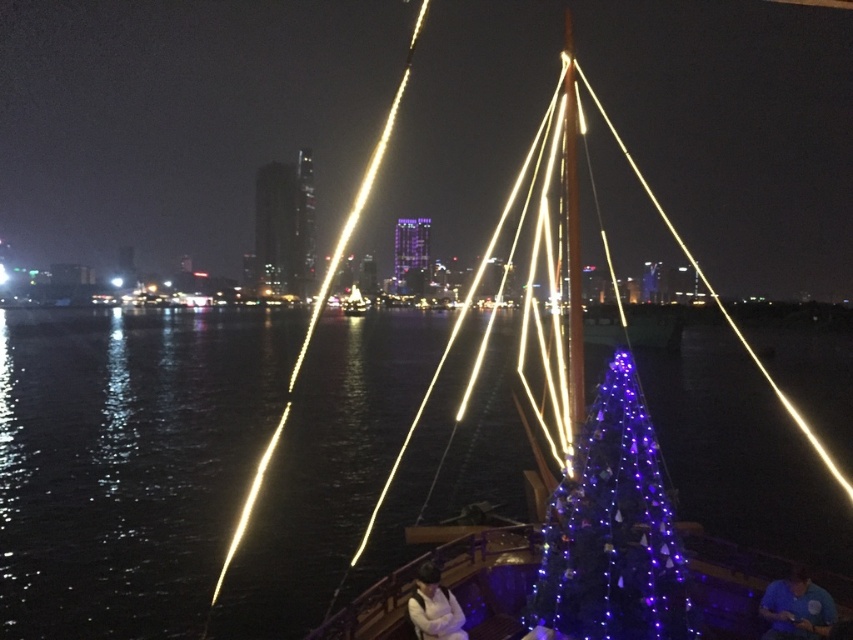
You are an observer on the boat and want to know which object is wider between the purple glossy christmas tree at center and the metallic gold mast at center. Which one is wider?

The metallic gold mast at center is wider than the purple glossy christmas tree at center.